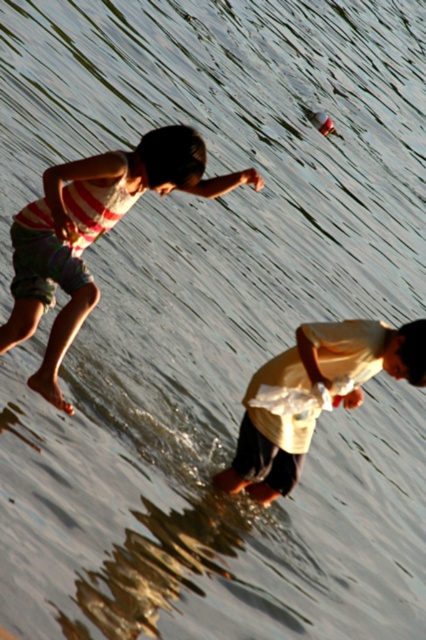
Can you confirm if striped cotton shorts at left is thinner than yellow cotton shirt at lower right?

No.

Does point (94, 225) come in front of point (420, 353)?

No.

Identify the location of striped cotton shorts at left. This screenshot has width=426, height=640. (92, 232).